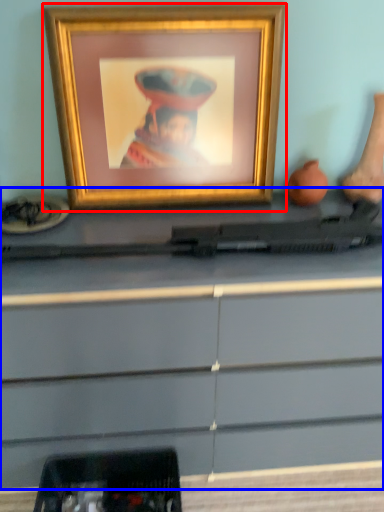
Question: Among these objects, which one is farthest to the camera, picture frame (highlighted by a red box) or desk (highlighted by a blue box)?

Choices:
 (A) picture frame
 (B) desk

Answer: (A)